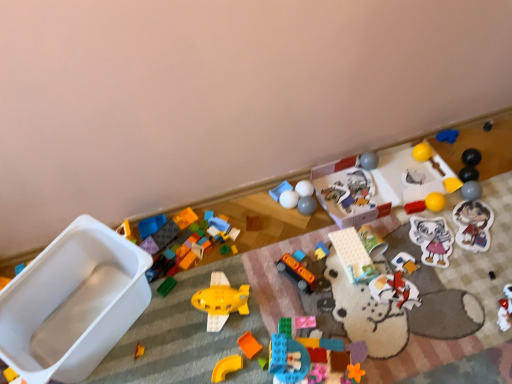
You are a GUI agent. You are given a task and a screenshot of the screen. Output one action in this format:
    pyautogui.click(x=<x>, y=<y>)
    Task: Click on the vacant area that lies between orange plastic block at lower left, which is the third toy in left-to-right order, and pink matte block at center, acting as the 14th toy starting from the right
    
    Given the screenshot: What is the action you would take?
    pyautogui.click(x=208, y=341)